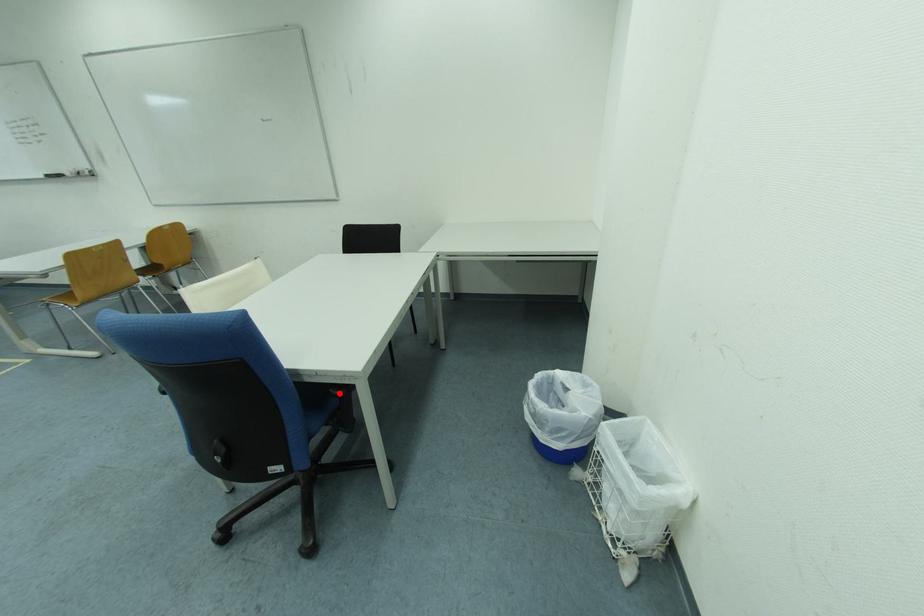
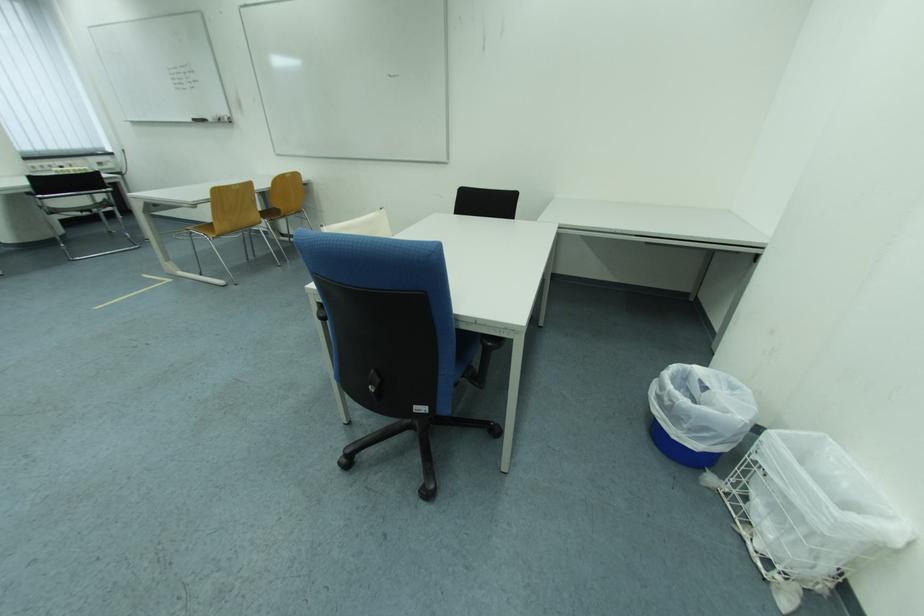
Find the pixel in the second image that matches the highlighted location in the first image.

(493, 344)